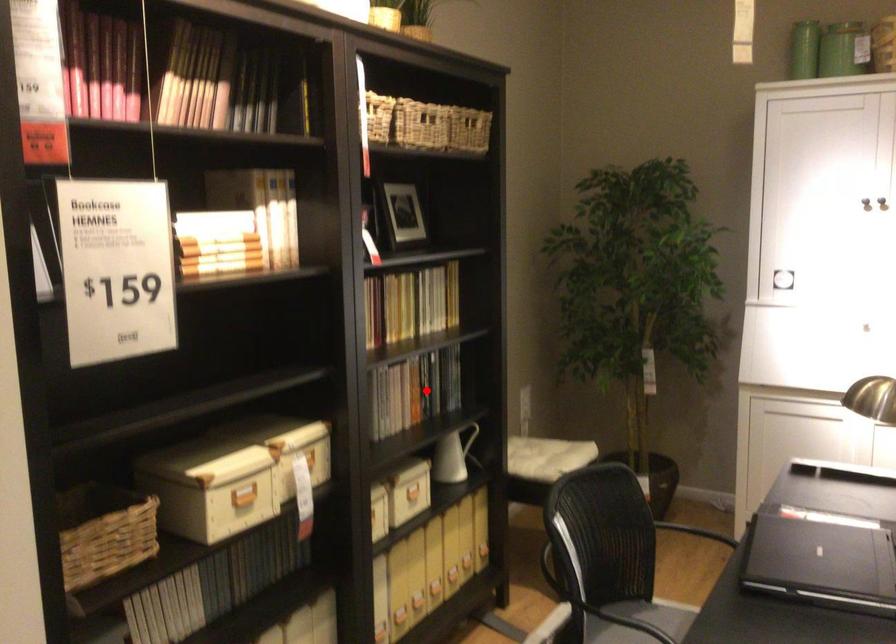
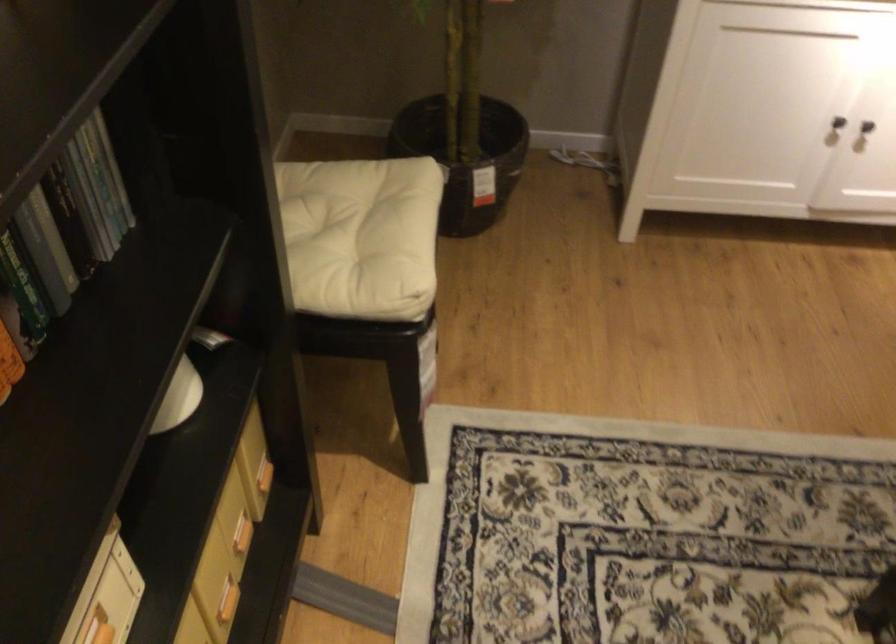
Question: I am providing you with two images of the same scene from different viewpoints. A red point is marked on the first image. Can you still see the location of the red point in image 2?

Choices:
 (A) Yes
 (B) No

Answer: (A)